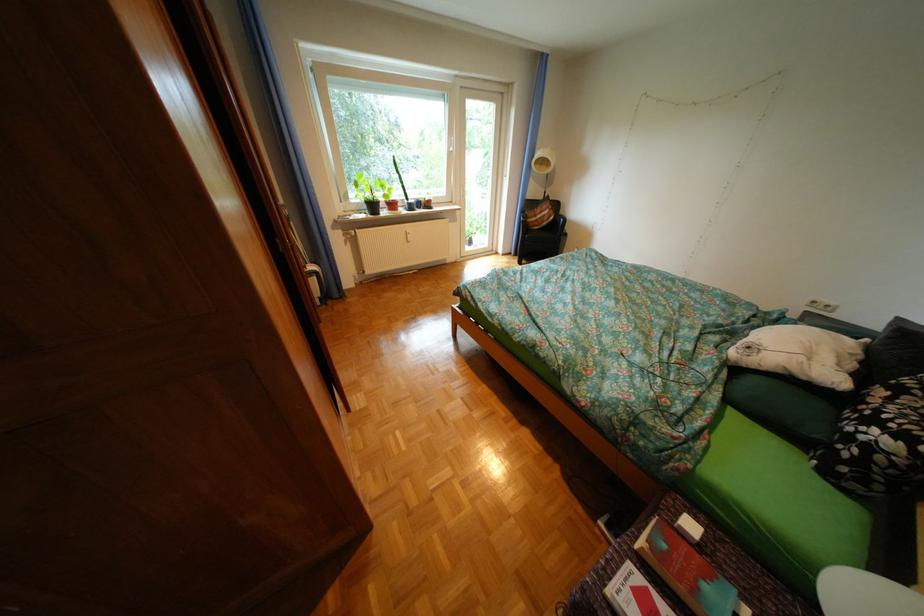
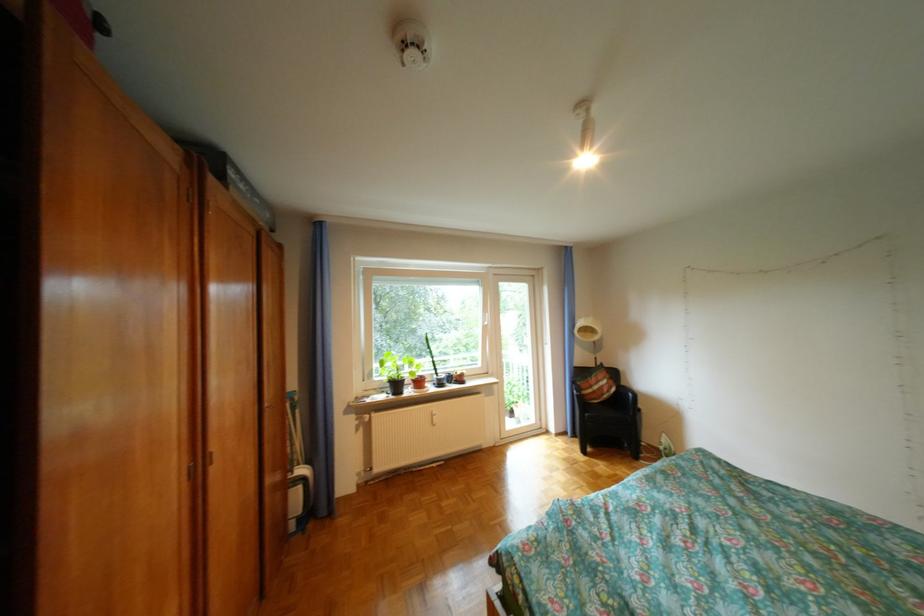
Locate, in the second image, the point that corresponds to [387,207] in the first image.

(410, 386)